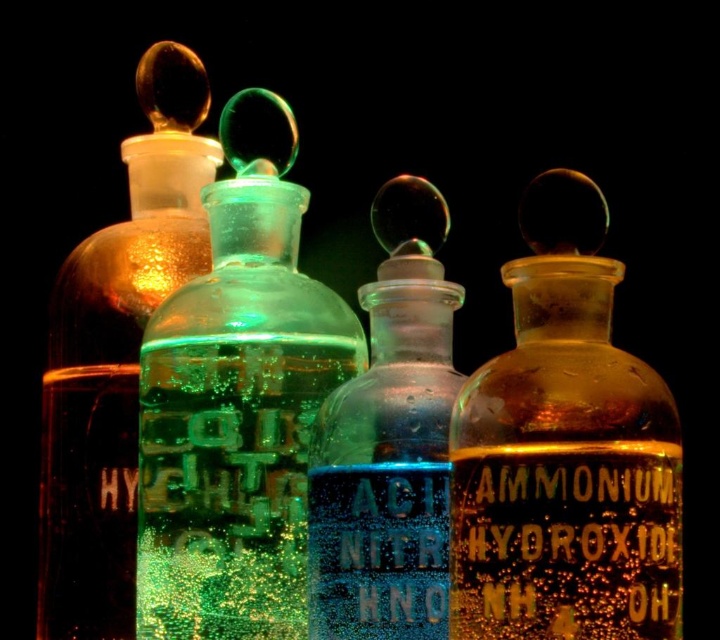
You are a lab technician who needs to retrieve the ACID bottle. You see the green frosted glass bottle at center and the blue glass bottle at center. Which one is positioned higher?

The green frosted glass bottle at center is located above the blue glass bottle at center, so the green frosted glass bottle at center is higher.

Which of the two bottles, the amber glass bottle at center or the translucent amber glass bottle at left, is positioned to the right?

The amber glass bottle at center is positioned to the right of the translucent amber glass bottle at left.